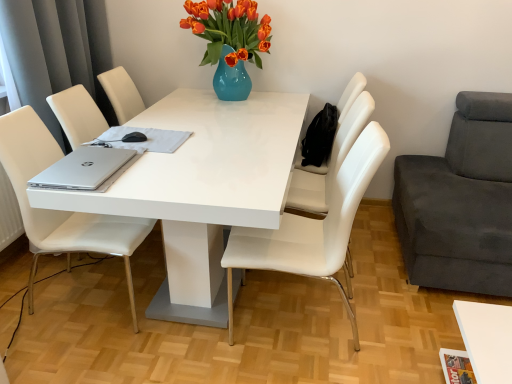
This screenshot has height=384, width=512. What are the coordinates of `vacant area that lies to the right of white cloth at center` in the screenshot? It's located at (215, 140).